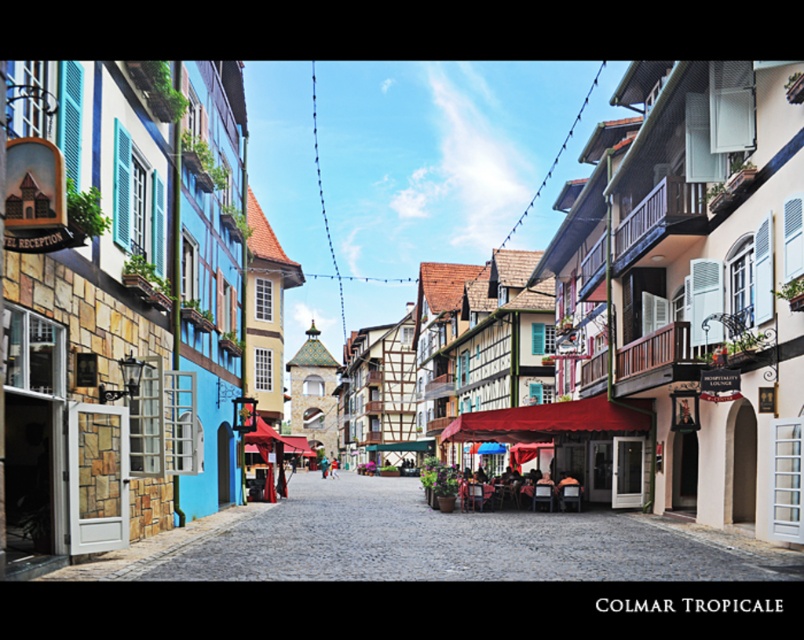
Question: Which point appears farthest from the camera in this image?

Choices:
 (A) (210, 560)
 (B) (544, 435)

Answer: (B)

Question: Considering the relative positions of smooth stone street at center and red fabric canopy at center in the image provided, where is smooth stone street at center located with respect to red fabric canopy at center?

Choices:
 (A) left
 (B) right

Answer: (A)

Question: Which point is closer to the camera?

Choices:
 (A) (208, 572)
 (B) (634, 426)

Answer: (A)

Question: Does smooth stone street at center come behind red fabric canopy at center?

Choices:
 (A) yes
 (B) no

Answer: (B)

Question: Is smooth stone street at center thinner than red fabric canopy at center?

Choices:
 (A) no
 (B) yes

Answer: (A)